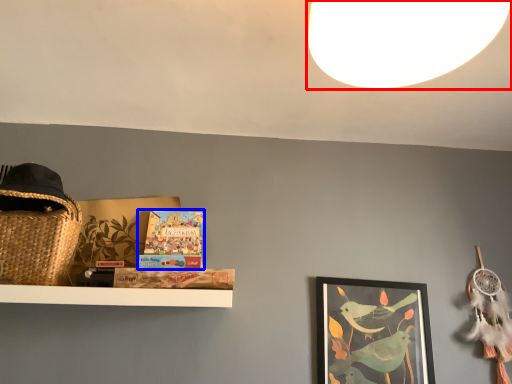
Question: Which point is further to the camera, light (highlighted by a red box) or book (highlighted by a blue box)?

Choices:
 (A) light
 (B) book

Answer: (B)